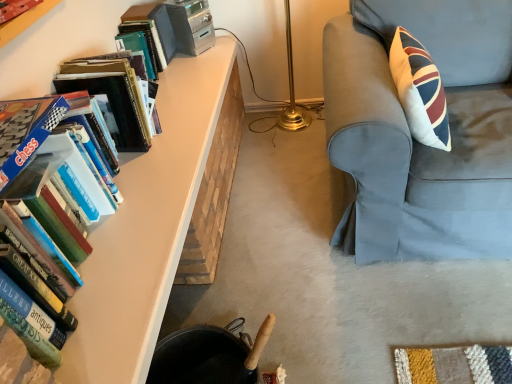
Question: Considering the relative positions of light blue fabric chair at right and matte white table at left in the image provided, is light blue fabric chair at right to the left of matte white table at left from the viewer's perspective?

Choices:
 (A) no
 (B) yes

Answer: (A)

Question: Is light blue fabric chair at right positioned behind matte white table at left?

Choices:
 (A) yes
 (B) no

Answer: (B)

Question: Is matte white table at left surrounded by light blue fabric chair at right?

Choices:
 (A) no
 (B) yes

Answer: (A)

Question: Is light blue fabric chair at right positioned beyond the bounds of matte white table at left?

Choices:
 (A) no
 (B) yes

Answer: (B)

Question: Considering the relative sizes of light blue fabric chair at right and matte white table at left in the image provided, is light blue fabric chair at right shorter than matte white table at left?

Choices:
 (A) yes
 (B) no

Answer: (B)

Question: Considering the relative positions of light blue fabric chair at right and matte white table at left in the image provided, is light blue fabric chair at right to the right of matte white table at left from the viewer's perspective?

Choices:
 (A) no
 (B) yes

Answer: (B)

Question: Is gold metallic table lamp at center not within matte plastic bookcase at upper left?

Choices:
 (A) yes
 (B) no

Answer: (A)

Question: From a real-world perspective, is gold metallic table lamp at center under matte plastic bookcase at upper left?

Choices:
 (A) yes
 (B) no

Answer: (A)

Question: From a real-world perspective, is gold metallic table lamp at center physically above matte plastic bookcase at upper left?

Choices:
 (A) yes
 (B) no

Answer: (B)

Question: Considering the relative sizes of gold metallic table lamp at center and matte plastic bookcase at upper left in the image provided, is gold metallic table lamp at center shorter than matte plastic bookcase at upper left?

Choices:
 (A) no
 (B) yes

Answer: (A)

Question: Could you tell me if gold metallic table lamp at center is facing matte plastic bookcase at upper left?

Choices:
 (A) no
 (B) yes

Answer: (A)

Question: From the image's perspective, is gold metallic table lamp at center under matte plastic bookcase at upper left?

Choices:
 (A) yes
 (B) no

Answer: (B)

Question: Considering the relative sizes of matte white table at left and hardcover book at upper left, which is the first book in top-to-bottom order, in the image provided, is matte white table at left bigger than hardcover book at upper left, which is the first book in top-to-bottom order,?

Choices:
 (A) no
 (B) yes

Answer: (B)